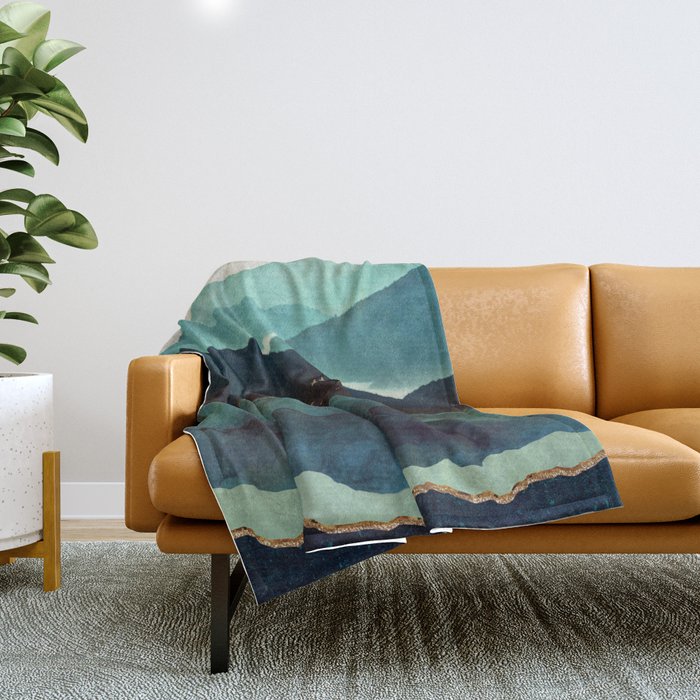
Identify the location of wood flooring. (97, 525).